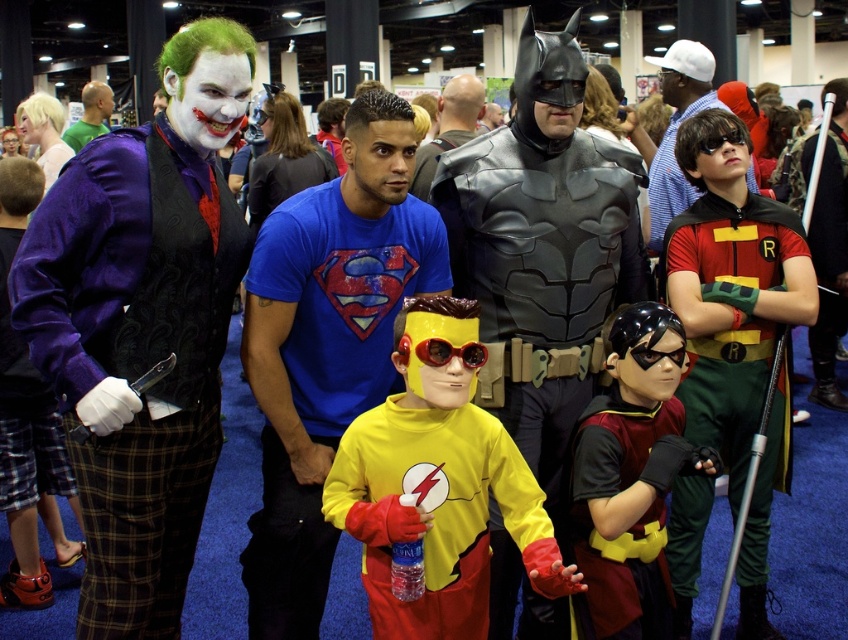
Consider the image. Does yellow matte shirt at center have a smaller size compared to smooth black suit at center?

Correct, yellow matte shirt at center occupies less space than smooth black suit at center.

Is yellow matte shirt at center thinner than smooth black suit at center?

No.

What do you see at coordinates (438, 484) in the screenshot? I see `yellow matte shirt at center` at bounding box center [438, 484].

The image size is (848, 640). Find the location of `yellow matte shirt at center`. yellow matte shirt at center is located at coordinates (438, 484).

Does smooth black suit at center appear over matte black vest at left?

Actually, smooth black suit at center is below matte black vest at left.

Can you confirm if smooth black suit at center is positioned to the left of matte black vest at left?

No, smooth black suit at center is not to the left of matte black vest at left.

Which is behind, point (419, 157) or point (75, 124)?

The point (75, 124) is more distant.

Where is `smooth black suit at center`? The image size is (848, 640). smooth black suit at center is located at coordinates (449, 128).

Is shiny black costume at center above smooth black suit at center?

Yes.

Between shiny black costume at center and smooth black suit at center, which one has less height?

Standing shorter between the two is shiny black costume at center.

Which is behind, point (701, 70) or point (470, 134)?

The point (470, 134) is behind.

At what (x,y) coordinates should I click in order to perform the action: click on shiny black costume at center. Please return your answer as a coordinate pair (x, y). The width and height of the screenshot is (848, 640). Looking at the image, I should click on (676, 129).